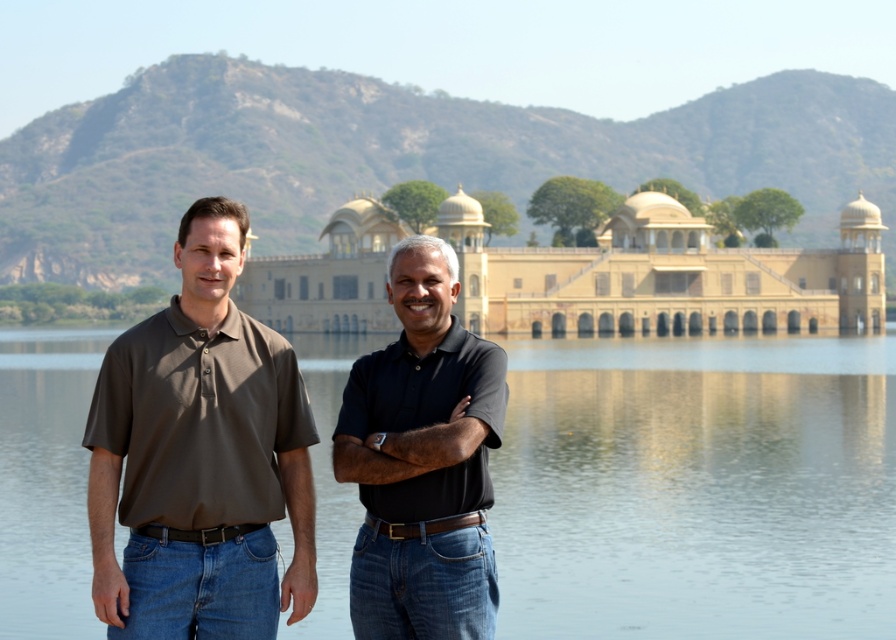
Question: Does beige stone palace at center have a larger size compared to black matte shirt at center?

Choices:
 (A) no
 (B) yes

Answer: (B)

Question: Among these objects, which one is nearest to the camera?

Choices:
 (A) clear water at center
 (B) matte brown shirt at left
 (C) beige stone palace at center

Answer: (B)

Question: Which point is farther to the camera?

Choices:
 (A) clear water at center
 (B) black matte shirt at center
 (C) matte brown shirt at left

Answer: (B)

Question: Is clear water at center smaller than beige stone palace at center?

Choices:
 (A) yes
 (B) no

Answer: (B)

Question: Is clear water at center above black matte shirt at center?

Choices:
 (A) yes
 (B) no

Answer: (A)

Question: Which point is closer to the camera?

Choices:
 (A) clear water at center
 (B) beige stone palace at center
 (C) black matte shirt at center
 (D) matte brown shirt at left

Answer: (D)